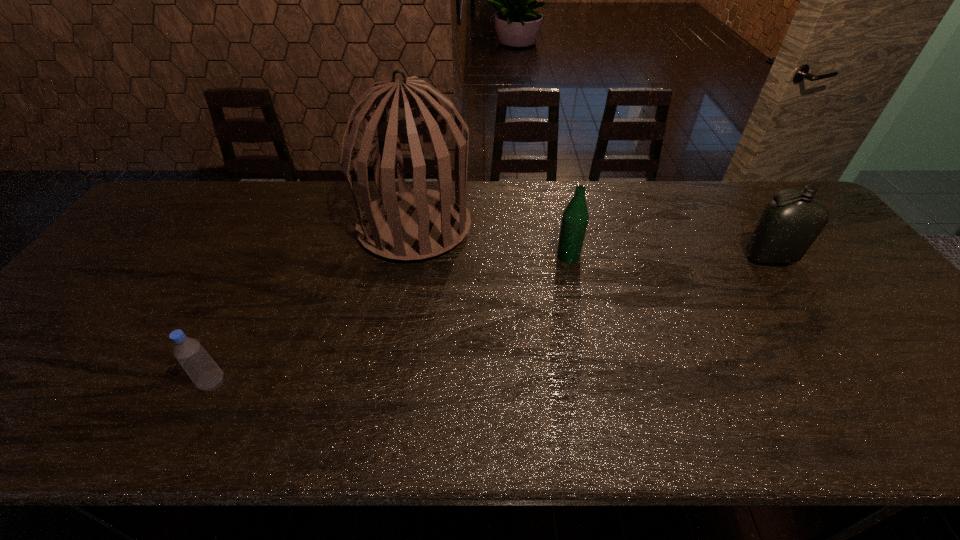
Where is `free region that satisfies the following two spatial constraints: 1. on the front side of the second object from left to right; 2. on the right side of the second bottle from left to right`? This screenshot has height=540, width=960. free region that satisfies the following two spatial constraints: 1. on the front side of the second object from left to right; 2. on the right side of the second bottle from left to right is located at coordinates (410, 256).

Locate an element on the screen. vacant area in the image that satisfies the following two spatial constraints: 1. on the back side of the second object from left to right; 2. on the right side of the leftmost bottle is located at coordinates (289, 226).

The image size is (960, 540). In order to click on vacant area in the image that satisfies the following two spatial constraints: 1. on the back side of the third object from left to right; 2. on the left side of the shortest object in this screenshot , I will do `click(275, 256)`.